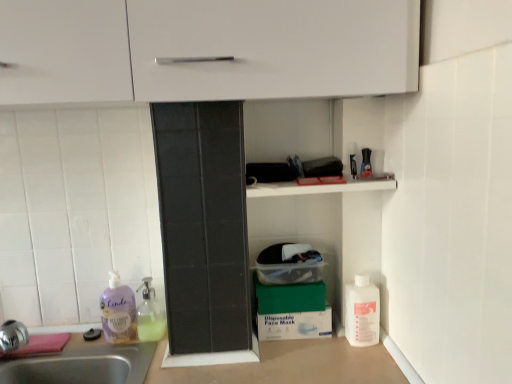
Question: Is green matte box at lower center in front of or behind white plastic bottle at lower right, the 1th cleaning product from the right, in the image?

Choices:
 (A) front
 (B) behind

Answer: (B)

Question: Considering the positions of green matte box at lower center and white plastic bottle at lower right, the 1th cleaning product from the right, in the image, is green matte box at lower center taller or shorter than white plastic bottle at lower right, the 1th cleaning product from the right,?

Choices:
 (A) tall
 (B) short

Answer: (B)

Question: Which of these objects is positioned farthest from the purple liquid soap at lower left, which ranks as the third cleaning product in right-to-left order?

Choices:
 (A) translucent glass soap dispenser at lower left, marked as the 2th cleaning product in a right-to-left arrangement
 (B) green cardboard box at lower center
 (C) green matte box at lower center
 (D) white plastic bottle at lower right, the 1th cleaning product from the right

Answer: (D)

Question: Estimate the real-world distances between objects in this image. Which object is closer to the green cardboard box at lower center?

Choices:
 (A) green matte box at lower center
 (B) translucent glass soap dispenser at lower left, marked as the 2th cleaning product in a right-to-left arrangement
 (C) white plastic bottle at lower right, the 1th cleaning product from the right
 (D) purple liquid soap at lower left, which ranks as the third cleaning product in right-to-left order

Answer: (A)